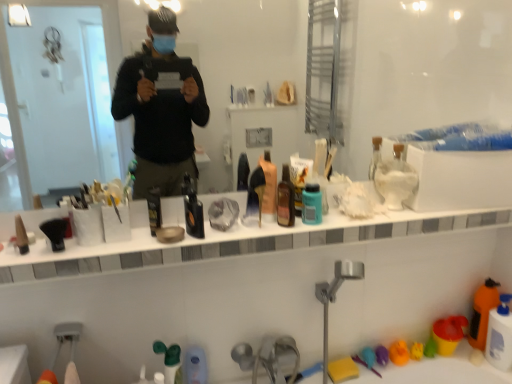
Describe the element at coordinates (399, 353) in the screenshot. I see `orange rubber duck at lower right, marked as the 2th toy in a left-to-right arrangement` at that location.

Describe the element at coordinates (312, 204) in the screenshot. I see `teal matte bottle at center, placed as the third mouthwash when sorted from left to right` at that location.

What is the approximate width of teal matte bottle at center, placed as the third mouthwash when sorted from left to right?

1.74 inches.

In order to click on white glossy counter top at center in this screenshot , I will do `click(230, 244)`.

What do you see at coordinates (500, 335) in the screenshot? I see `translucent plastic bottle at lower right, which is the 1th cleaning product in right-to-left order` at bounding box center [500, 335].

Identify the location of green matte toothpaste at lower center, placed as the 3th toiletry when sorted from front to back. This screenshot has height=384, width=512. (170, 362).

Locate an element on the screen. The height and width of the screenshot is (384, 512). orange rubber duck at lower right, positioned as the second toy in right-to-left order is located at coordinates (399, 353).

Locate an element on the screen. The width and height of the screenshot is (512, 384). the 3rd mouthwash behind when counting from the matte brown hairbrush at left, the 1th toiletry viewed from the top is located at coordinates (312, 204).

Would you say teal matte bottle at center, placed as the third mouthwash when sorted from left to right, is outside matte brown hairbrush at left, placed as the first toiletry when sorted from left to right?

teal matte bottle at center, placed as the third mouthwash when sorted from left to right, is positioned outside matte brown hairbrush at left, placed as the first toiletry when sorted from left to right.

From their relative heights in the image, would you say teal matte bottle at center, which ranks as the 1th mouthwash in right-to-left order, is taller or shorter than matte brown hairbrush at left, positioned as the fourth toiletry in bottom-to-top order?

teal matte bottle at center, which ranks as the 1th mouthwash in right-to-left order, is taller than matte brown hairbrush at left, positioned as the fourth toiletry in bottom-to-top order.

Would you say matte brown hairbrush at left, which ranks as the 2th toiletry in front-to-back order, is outside yellow sponge at lower center, the 3th toy when ordered from right to left?

Indeed, matte brown hairbrush at left, which ranks as the 2th toiletry in front-to-back order, is completely outside yellow sponge at lower center, the 3th toy when ordered from right to left.

Considering the relative sizes of matte brown hairbrush at left, positioned as the fourth toiletry in bottom-to-top order, and yellow sponge at lower center, the 1th toy positioned from the left, in the image provided, is matte brown hairbrush at left, positioned as the fourth toiletry in bottom-to-top order, wider than yellow sponge at lower center, the 1th toy positioned from the left,?

No, matte brown hairbrush at left, positioned as the fourth toiletry in bottom-to-top order, is not wider than yellow sponge at lower center, the 1th toy positioned from the left.

In the scene shown: From the image's perspective, is matte brown hairbrush at left, placed as the first toiletry when sorted from left to right, on top of yellow sponge at lower center, the 1th toy positioned from the left?

Yes.

Which is less distant, (18, 224) or (344, 364)?

The point (18, 224) is closer to the camera.

Is white glossy counter top at center not close to teal matte bottle at center, which ranks as the 1th mouthwash in right-to-left order?

white glossy counter top at center is near teal matte bottle at center, which ranks as the 1th mouthwash in right-to-left order, not far away.

From their relative heights in the image, would you say white glossy counter top at center is taller or shorter than teal matte bottle at center, which ranks as the 1th mouthwash in right-to-left order?

In the image, white glossy counter top at center appears to be shorter than teal matte bottle at center, which ranks as the 1th mouthwash in right-to-left order.

How different are the orientations of white glossy counter top at center and teal matte bottle at center, which ranks as the 1th mouthwash in right-to-left order, in degrees?

34.4 degrees.

Is white glossy counter top at center aimed at teal matte bottle at center, which ranks as the 1th mouthwash in right-to-left order?

Result: No, white glossy counter top at center is not turned towards teal matte bottle at center, which ranks as the 1th mouthwash in right-to-left order.

In the scene shown: Between white glossy counter top at center and orange plastic bottle at lower right, the second cleaning product from the top, which one has larger size?

white glossy counter top at center.

Where is `counter top above the orange plastic bottle at lower right, which is counted as the second cleaning product, starting from the left (from a real-world perspective)`? The height and width of the screenshot is (384, 512). counter top above the orange plastic bottle at lower right, which is counted as the second cleaning product, starting from the left (from a real-world perspective) is located at coordinates (230, 244).

From the image's perspective, is white glossy counter top at center located above or below orange plastic bottle at lower right, acting as the 2th cleaning product starting from the right?

white glossy counter top at center is above orange plastic bottle at lower right, acting as the 2th cleaning product starting from the right.

In the scene shown: Which object is further away from the camera, matte brown hairbrush at left, which ranks as the 2th toiletry in front-to-back order, or white matte bottle at upper center, positioned as the first cleaning product in top-to-bottom order?

white matte bottle at upper center, positioned as the first cleaning product in top-to-bottom order, is more distant.

Is matte brown hairbrush at left, the 4th toiletry from the right, inside the boundaries of white matte bottle at upper center, arranged as the first cleaning product when viewed from the left, or outside?

matte brown hairbrush at left, the 4th toiletry from the right, is not enclosed by white matte bottle at upper center, arranged as the first cleaning product when viewed from the left.

From the image's perspective, would you say matte brown hairbrush at left, which ranks as the 2th toiletry in front-to-back order, is shown under white matte bottle at upper center, which appears as the 3th cleaning product when viewed from the right?

Indeed, from the image's perspective, matte brown hairbrush at left, which ranks as the 2th toiletry in front-to-back order, is shown beneath white matte bottle at upper center, which appears as the 3th cleaning product when viewed from the right.

How far apart are matte brown hairbrush at left, the 3th toiletry when ordered from back to front, and white matte bottle at upper center, arranged as the first cleaning product when viewed from the left?

matte brown hairbrush at left, the 3th toiletry when ordered from back to front, is 3.40 feet away from white matte bottle at upper center, arranged as the first cleaning product when viewed from the left.

In the scene shown: Is transparent glass mirror at upper center spatially inside matte brown hairbrush at left, the 4th toiletry from the right, or outside of it?

The correct answer is: outside.

Image resolution: width=512 pixels, height=384 pixels. I want to click on mirror above the matte brown hairbrush at left, the 4th toiletry from the right (from the image's perspective), so click(426, 71).

Considering the relative positions of transparent glass mirror at upper center and matte brown hairbrush at left, the 4th toiletry from the right, in the image provided, is transparent glass mirror at upper center to the left or to the right of matte brown hairbrush at left, the 4th toiletry from the right,?

In the image, transparent glass mirror at upper center appears on the right side of matte brown hairbrush at left, the 4th toiletry from the right.

Are transparent glass mirror at upper center and matte brown hairbrush at left, which ranks as the 2th toiletry in front-to-back order, far apart?

Indeed, transparent glass mirror at upper center is not near matte brown hairbrush at left, which ranks as the 2th toiletry in front-to-back order.

Considering the relative sizes of white matte bottle at upper center, which appears as the third cleaning product when ordered from the bottom, and translucent plastic bottle at lower right, the first cleaning product in the bottom-to-top sequence, in the image provided, is white matte bottle at upper center, which appears as the third cleaning product when ordered from the bottom, taller than translucent plastic bottle at lower right, the first cleaning product in the bottom-to-top sequence,?

No.

From a real-world perspective, is white matte bottle at upper center, which appears as the 3th cleaning product when viewed from the right, physically located above or below translucent plastic bottle at lower right, which is the 3th cleaning product from top to bottom?

From a real-world perspective, white matte bottle at upper center, which appears as the 3th cleaning product when viewed from the right, is physically above translucent plastic bottle at lower right, which is the 3th cleaning product from top to bottom.

Is white matte bottle at upper center, which appears as the third cleaning product when ordered from the bottom, positioned before translucent plastic bottle at lower right, the third cleaning product in the left-to-right sequence?

Yes, white matte bottle at upper center, which appears as the third cleaning product when ordered from the bottom, is closer to the viewer.

Which of these two, white matte bottle at upper center, arranged as the first cleaning product when viewed from the left, or translucent plastic bottle at lower right, the third cleaning product in the left-to-right sequence, is bigger?

Bigger between the two is translucent plastic bottle at lower right, the third cleaning product in the left-to-right sequence.

From the image's perspective, count 1st toiletrys downward from the teal matte bottle at center, placed as the third mouthwash when sorted from left to right, and point to it. Please provide its 2D coordinates.

[(21, 235)]

Which toy is the 1st one when counting from the back of the matte brown hairbrush at left, the 4th toiletry from the right? Please provide its 2D coordinates.

[(342, 369)]

When comparing their distances from black matte hairbrush at left, acting as the 2th toiletry starting from the top, does black matte bottle at center, which ranks as the third mouthwash in right-to-left order, or transparent glass mirror at upper center seem closer?

black matte bottle at center, which ranks as the third mouthwash in right-to-left order, is closer to black matte hairbrush at left, acting as the 2th toiletry starting from the top.

Which object lies further to the anchor point green matte toothpaste at lower center, the 3th toiletry in the top-to-bottom sequence, translucent plastic bottle at lower right, which is the 1th cleaning product in right-to-left order, or black matte hairbrush at left, positioned as the 3th toiletry in bottom-to-top order?

translucent plastic bottle at lower right, which is the 1th cleaning product in right-to-left order, is further to green matte toothpaste at lower center, the 3th toiletry in the top-to-bottom sequence.

When comparing their distances from brown glass bottle at center, the second mouthwash in the left-to-right sequence, does translucent plastic bottle at lower right, the third cleaning product in the left-to-right sequence, or translucent plastic bottle at lower center, arranged as the 1th toiletry when viewed from the right, seem closer?

Based on the image, translucent plastic bottle at lower center, arranged as the 1th toiletry when viewed from the right, appears to be nearer to brown glass bottle at center, the second mouthwash in the left-to-right sequence.

Looking at the image, which one is located further to white glossy counter top at center, black matte hairbrush at left, the fourth toiletry positioned from the back, or brown glass bottle at center, the second mouthwash in the right-to-left sequence?

black matte hairbrush at left, the fourth toiletry positioned from the back, lies further to white glossy counter top at center than the other object.

Estimate the real-world distances between objects in this image. Which object is further from black matte hairbrush at left, the 2th toiletry positioned from the left, green matte toothpaste at lower center, marked as the third toiletry in a left-to-right arrangement, or black matte bottle at center?

The object further to black matte hairbrush at left, the 2th toiletry positioned from the left, is black matte bottle at center.

From the picture: When comparing their distances from black matte bottle at center, which ranks as the third mouthwash in right-to-left order, does matte brown hairbrush at left, the 4th toiletry from the right, or white glossy counter top at center seem further?

white glossy counter top at center lies further to black matte bottle at center, which ranks as the third mouthwash in right-to-left order, than the other object.

Estimate the real-world distances between objects in this image. Which object is closer to translucent plastic bottle at lower center, the 1th toiletry in the back-to-front sequence, translucent plastic bottle at lower right, which is the 3th cleaning product from top to bottom, or matte brown hairbrush at left, the 1th toiletry viewed from the top?

matte brown hairbrush at left, the 1th toiletry viewed from the top, is positioned closer to the anchor translucent plastic bottle at lower center, the 1th toiletry in the back-to-front sequence.

Which object lies further to the anchor point white glossy counter top at center, yellow rubber duck at lower right, the first toy viewed from the right, or teal matte bottle at center, placed as the third mouthwash when sorted from left to right?

yellow rubber duck at lower right, the first toy viewed from the right.

Locate an element on the screen. mirror between black matte hairbrush at left, the 2th toiletry positioned from the left, and white glossy counter top at center is located at coordinates (426, 71).

Locate an element on the screen. The width and height of the screenshot is (512, 384). cleaning product situated between black matte bottle at center, which ranks as the third mouthwash in right-to-left order, and orange rubber duck at lower right, positioned as the second toy in right-to-left order, from left to right is located at coordinates (395, 179).

Find the location of a particular element. mouthwash between black matte hairbrush at left, positioned as the 1th toiletry in front-to-back order, and black matte bottle at center, in the horizontal direction is located at coordinates (154, 209).

Find the location of a particular element. The width and height of the screenshot is (512, 384). counter top that lies between transparent glass mirror at upper center and yellow sponge at lower center, the 3th toy when ordered from right to left, from top to bottom is located at coordinates (230, 244).